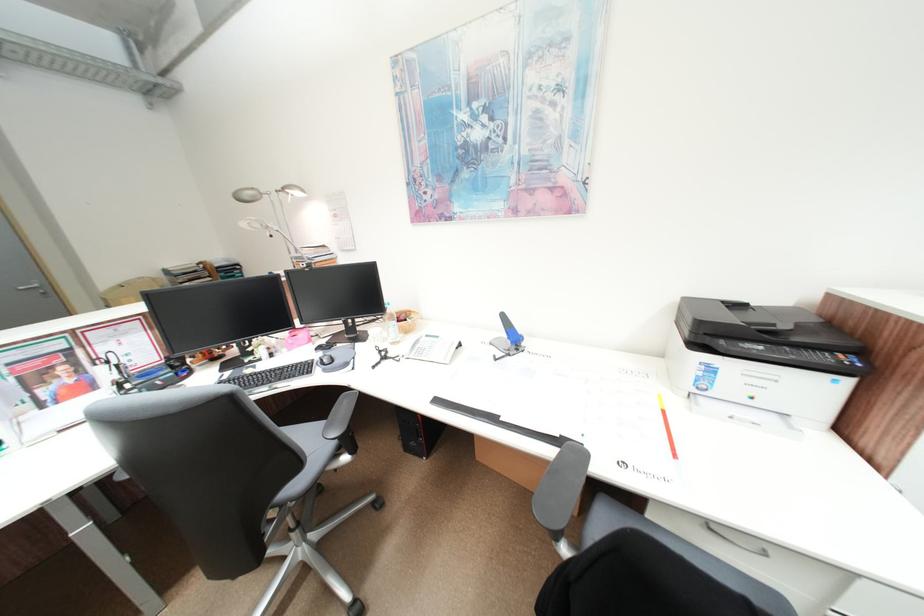
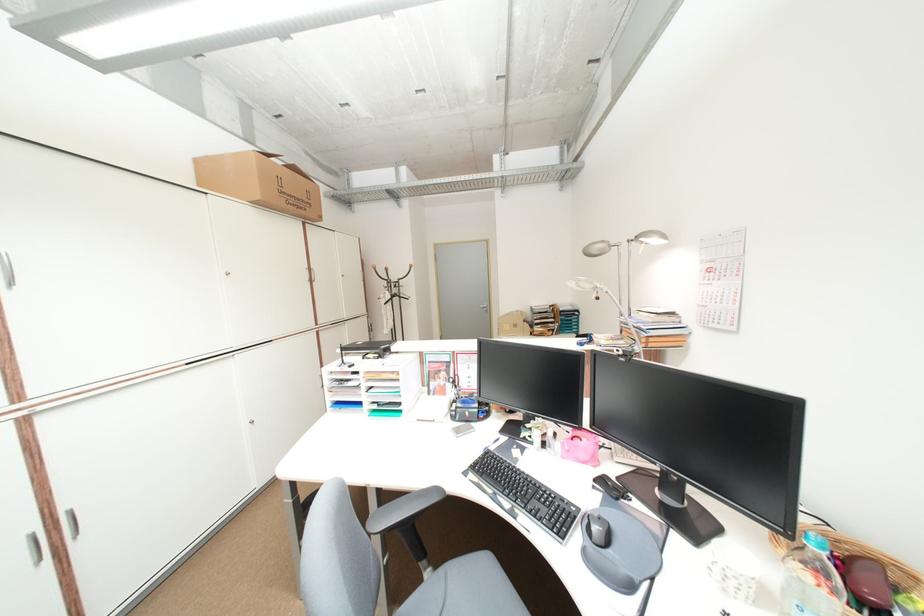
In the second image, find the point that corresponds to point 330,347 in the first image.

(613, 482)